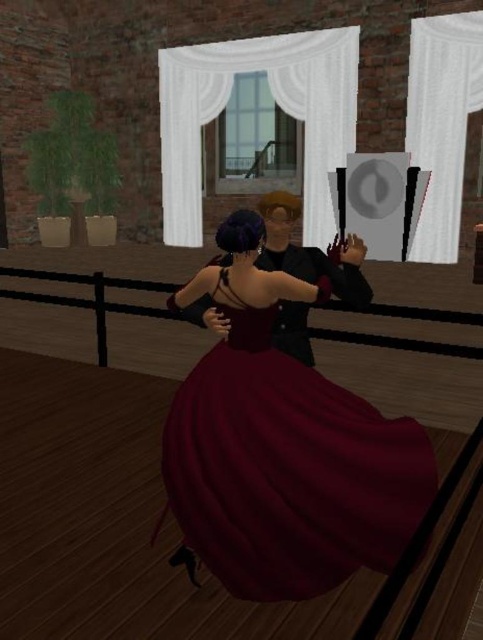
Question: Which point appears closest to the camera in this image?

Choices:
 (A) (197, 406)
 (B) (302, 305)

Answer: (A)

Question: Is burgundy satin dress at center below shiny black suit at center?

Choices:
 (A) no
 (B) yes

Answer: (B)

Question: Which of the following is the closest to the observer?

Choices:
 (A) shiny black suit at center
 (B) burgundy satin dress at center

Answer: (B)

Question: Which of the following is the farthest from the observer?

Choices:
 (A) (290, 364)
 (B) (364, 291)

Answer: (B)

Question: Where is burgundy satin dress at center located in relation to shiny black suit at center in the image?

Choices:
 (A) left
 (B) right

Answer: (A)

Question: Observing the image, what is the correct spatial positioning of burgundy satin dress at center in reference to shiny black suit at center?

Choices:
 (A) below
 (B) above

Answer: (A)